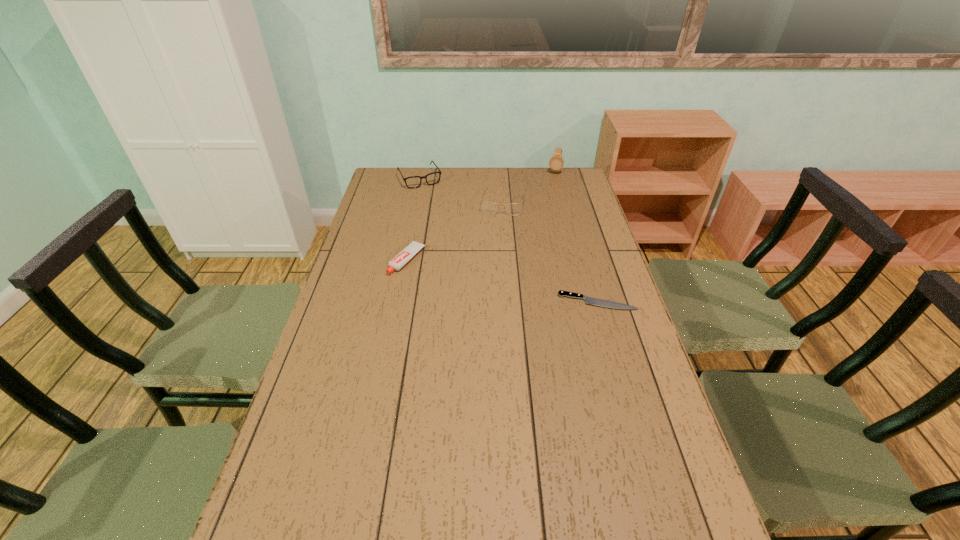
Locate an element on the screen. vacant space in between the tallest object and the toothpaste is located at coordinates (481, 216).

At what (x,y) coordinates should I click in order to perform the action: click on vacant point located between the farther spectacles and the watch. Please return your answer as a coordinate pair (x, y). The image size is (960, 540). Looking at the image, I should click on (487, 175).

At what (x,y) coordinates should I click in order to perform the action: click on object that ranks as the closest to the tallest object. Please return your answer as a coordinate pair (x, y). Image resolution: width=960 pixels, height=540 pixels. Looking at the image, I should click on (487, 207).

The height and width of the screenshot is (540, 960). Identify the location of object that is the second nearest to the watch. (432, 178).

Locate an element on the screen. Image resolution: width=960 pixels, height=540 pixels. free space that satisfies the following two spatial constraints: 1. on the back side of the third object from right to left; 2. on the right side of the toothpaste is located at coordinates (419, 204).